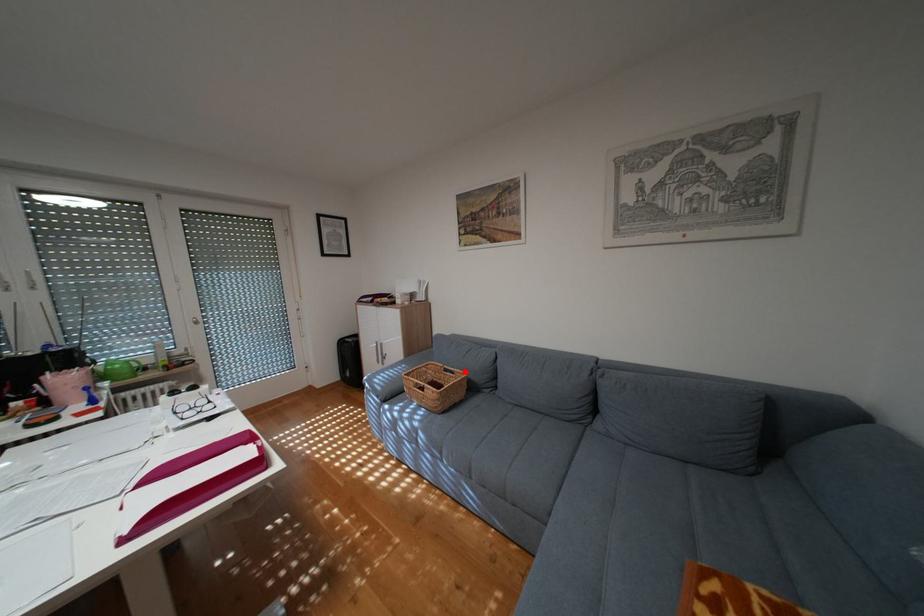
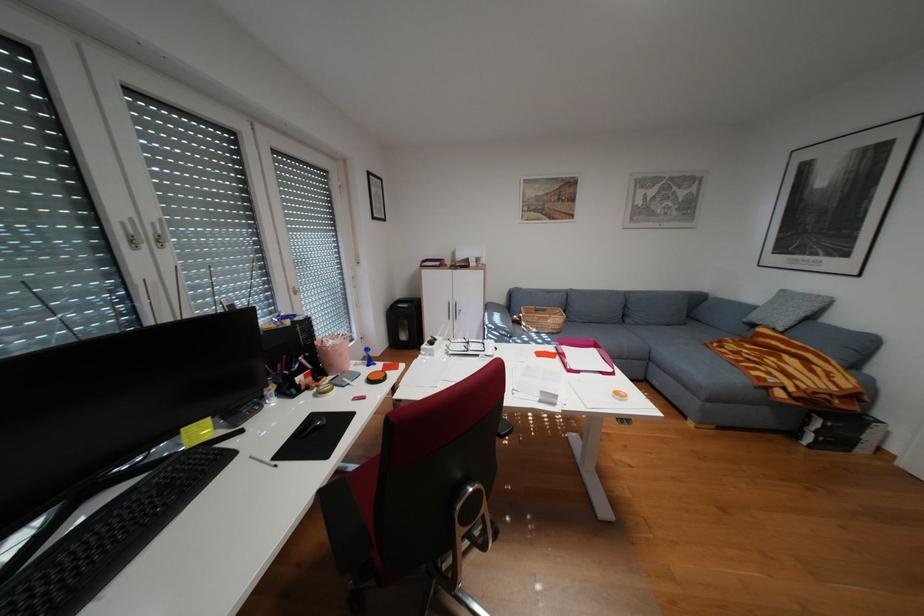
Where in the second image is the point corresponding to the highlighted location from the first image?

(556, 310)